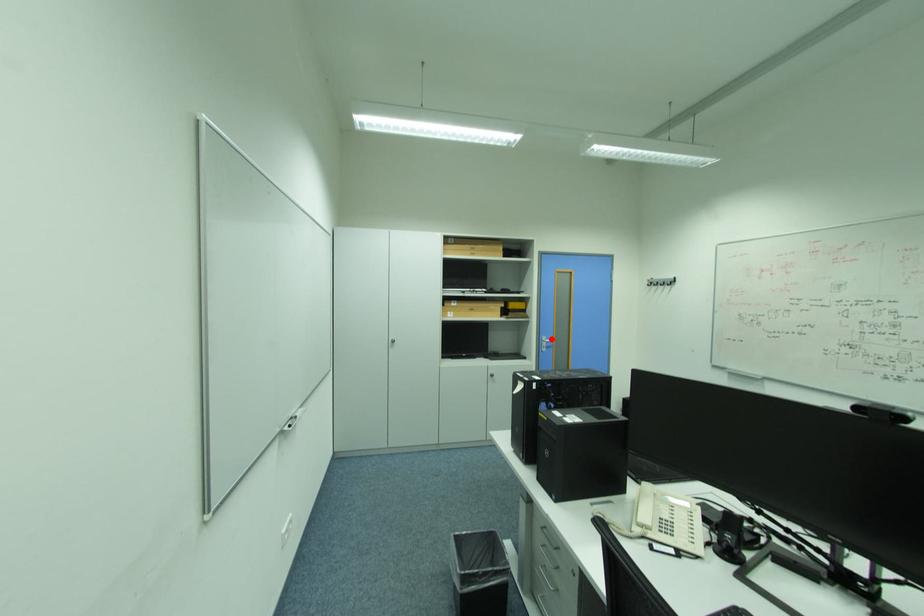
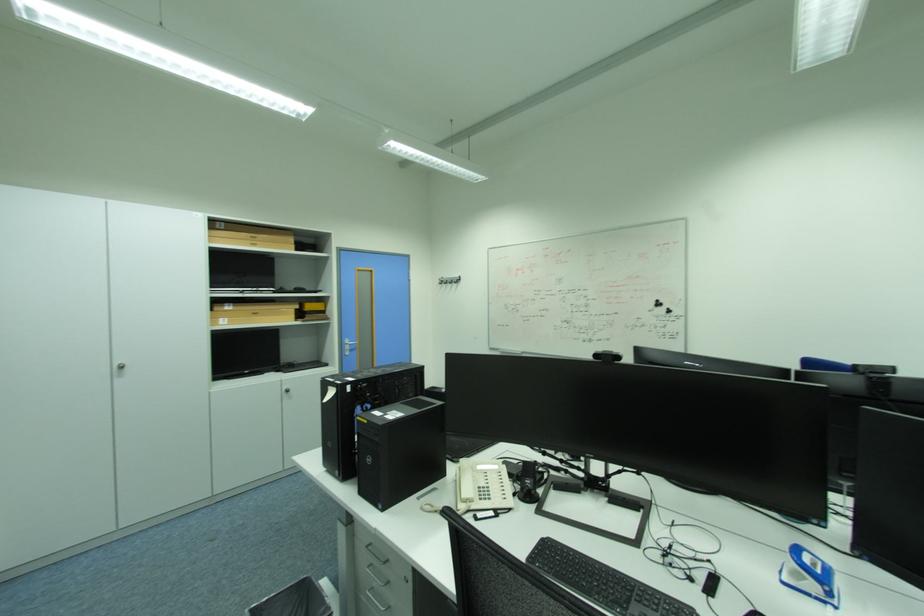
Question: A red point is marked in image1. In image2, is the corresponding 3D point closer to the camera or farther? Reply with the corresponding letter.

Choices:
 (A) The corresponding 3D point is closer.
 (B) The corresponding 3D point is farther.

Answer: (A)